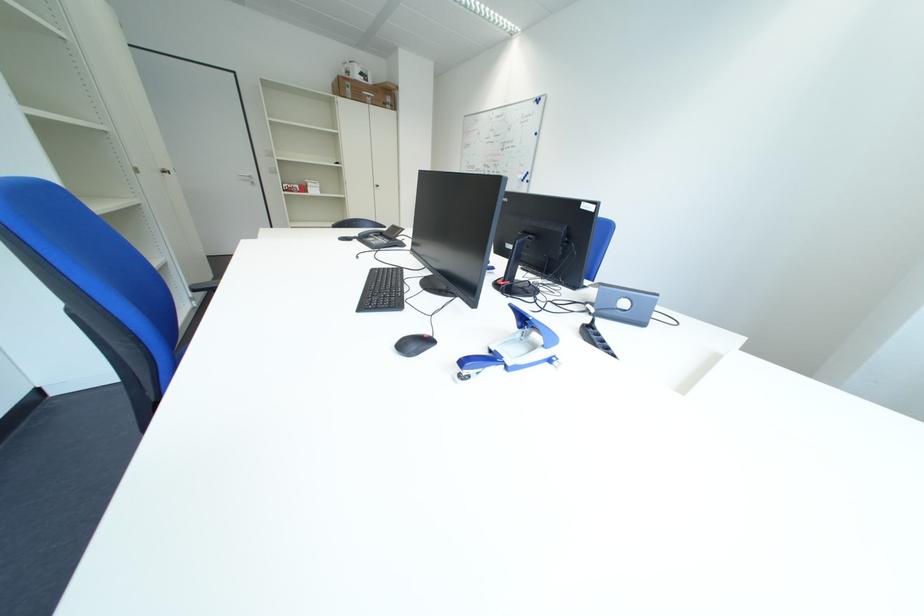
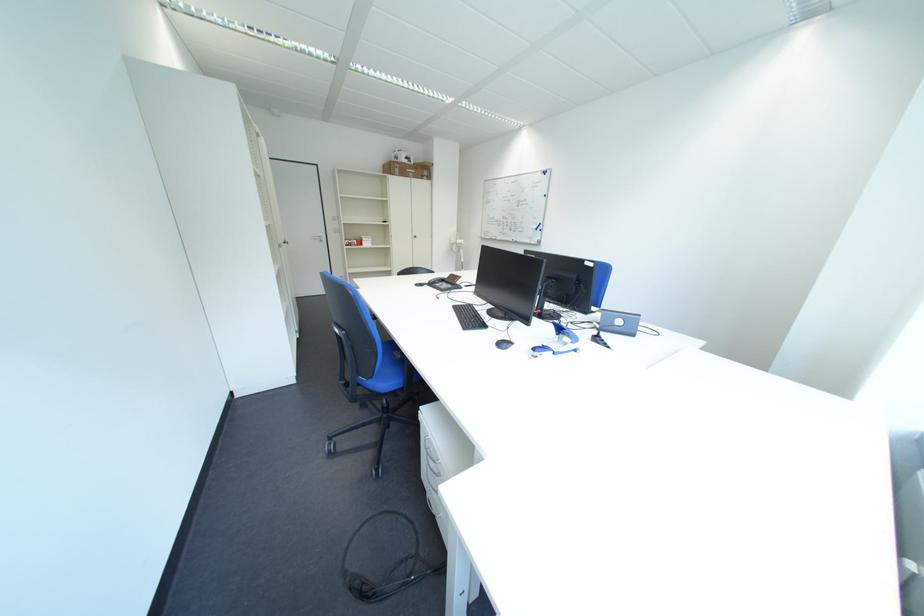
Looking at this image, in a continuous first-person perspective shot, in which direction is the camera moving?

The cameraman walked toward left, backward.